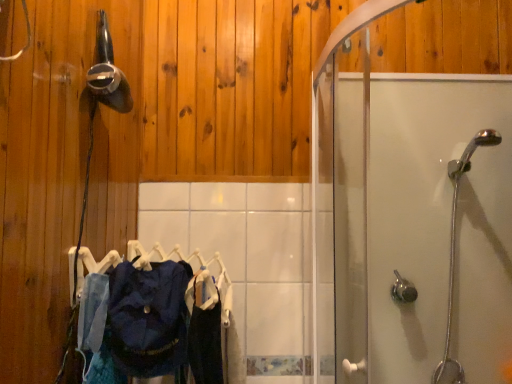
This screenshot has height=384, width=512. Describe the element at coordinates (148, 318) in the screenshot. I see `dark blue fabric at center, the first clothing in the left-to-right sequence` at that location.

Identify the location of dark blue fabric at center, acting as the 1th clothing starting from the right. The height and width of the screenshot is (384, 512). (205, 343).

Where is `transparent glass shower door at right`? transparent glass shower door at right is located at coordinates point(415,214).

Find the location of a particular element. This screenshot has height=384, width=512. the 2nd shower to the right of the metallic silver hairdryer at upper left, the 1th shower positioned from the left, starting your count from the anchor is located at coordinates (455, 252).

Is chrome metallic showerhead at right, which is counted as the first shower, starting from the right, bigger than metallic silver hairdryer at upper left, the third shower ordered from the bottom?

Correct, chrome metallic showerhead at right, which is counted as the first shower, starting from the right, is larger in size than metallic silver hairdryer at upper left, the third shower ordered from the bottom.

From a real-world perspective, is chrome metallic showerhead at right, which is counted as the first shower, starting from the right, located higher than metallic silver hairdryer at upper left, the third shower viewed from the right?

No, from a real-world perspective, chrome metallic showerhead at right, which is counted as the first shower, starting from the right, is not above metallic silver hairdryer at upper left, the third shower viewed from the right.

Does transparent glass shower door at right appear on the left side of dark blue fabric at center, the first clothing in the left-to-right sequence?

In fact, transparent glass shower door at right is to the right of dark blue fabric at center, the first clothing in the left-to-right sequence.

Considering the sizes of objects transparent glass shower door at right and dark blue fabric at center, which is counted as the second clothing, starting from the right, in the image provided, who is smaller, transparent glass shower door at right or dark blue fabric at center, which is counted as the second clothing, starting from the right,?

dark blue fabric at center, which is counted as the second clothing, starting from the right.

Considering the relative positions of transparent glass shower door at right and dark blue fabric at center, the first clothing in the left-to-right sequence, in the image provided, is transparent glass shower door at right in front of dark blue fabric at center, the first clothing in the left-to-right sequence,?

Yes, transparent glass shower door at right is closer to the camera.

Is transparent glass shower door at right facing towards dark blue fabric at center, the first clothing in the left-to-right sequence?

Yes, transparent glass shower door at right is facing dark blue fabric at center, the first clothing in the left-to-right sequence.

Is dark blue fabric at center, which is counted as the second clothing, starting from the right, positioned before dark blue fabric at center, the second clothing when ordered from left to right?

Yes, it is.

Considering the relative sizes of dark blue fabric at center, which is counted as the second clothing, starting from the right, and dark blue fabric at center, the second clothing when ordered from left to right, in the image provided, is dark blue fabric at center, which is counted as the second clothing, starting from the right, shorter than dark blue fabric at center, the second clothing when ordered from left to right,?

Yes.

Looking at this image, is dark blue fabric at center, the second clothing when ordered from left to right, at the back of dark blue fabric at center, which is counted as the second clothing, starting from the right?

No, dark blue fabric at center, which is counted as the second clothing, starting from the right, is not facing the opposite direction of dark blue fabric at center, the second clothing when ordered from left to right.

Considering the relative positions of transparent glass shower door at right and chrome metallic showerhead at right, which is counted as the second shower, starting from the bottom, in the image provided, is transparent glass shower door at right in front of chrome metallic showerhead at right, which is counted as the second shower, starting from the bottom,?

Yes, the depth of transparent glass shower door at right is less than that of chrome metallic showerhead at right, which is counted as the second shower, starting from the bottom.

From a real-world perspective, who is located higher, transparent glass shower door at right or chrome metallic showerhead at right, which is counted as the first shower, starting from the right?

transparent glass shower door at right.

In the scene shown: Which of these two, transparent glass shower door at right or chrome metallic showerhead at right, placed as the 2th shower when sorted from top to bottom, is thinner?

chrome metallic showerhead at right, placed as the 2th shower when sorted from top to bottom, is thinner.

From the image's perspective, between transparent glass shower door at right and chrome metallic showerhead at right, placed as the 2th shower when sorted from top to bottom, which one is located above?

transparent glass shower door at right, from the image's perspective.

Is dark blue fabric at center, which is counted as the second clothing, starting from the right, smaller than blue fabric clothes at center?

Indeed, dark blue fabric at center, which is counted as the second clothing, starting from the right, has a smaller size compared to blue fabric clothes at center.

Where is `laundry behind the dark blue fabric at center, which is counted as the second clothing, starting from the right`? The image size is (512, 384). laundry behind the dark blue fabric at center, which is counted as the second clothing, starting from the right is located at coordinates (213, 308).

Could blue fabric clothes at center be considered to be inside dark blue fabric at center, which is counted as the second clothing, starting from the right?

No, dark blue fabric at center, which is counted as the second clothing, starting from the right, does not contain blue fabric clothes at center.

Considering the positions of objects metallic silver hairdryer at upper left, the third shower ordered from the bottom, and transparent glass shower door at right in the image provided, who is in front, metallic silver hairdryer at upper left, the third shower ordered from the bottom, or transparent glass shower door at right?

transparent glass shower door at right is in front.

From the picture: Considering the relative sizes of metallic silver hairdryer at upper left, the 1th shower positioned from the left, and transparent glass shower door at right in the image provided, is metallic silver hairdryer at upper left, the 1th shower positioned from the left, bigger than transparent glass shower door at right?

Actually, metallic silver hairdryer at upper left, the 1th shower positioned from the left, might be smaller than transparent glass shower door at right.

Considering the sizes of objects metallic silver hairdryer at upper left, the third shower ordered from the bottom, and transparent glass shower door at right in the image provided, who is wider, metallic silver hairdryer at upper left, the third shower ordered from the bottom, or transparent glass shower door at right?

With larger width is transparent glass shower door at right.

Measure the distance between metallic silver hairdryer at upper left, which is counted as the 1th shower, starting from the top, and transparent glass shower door at right.

The distance of metallic silver hairdryer at upper left, which is counted as the 1th shower, starting from the top, from transparent glass shower door at right is 34.05 inches.

Who is taller, chrome metallic showerhead at right, which is counted as the first shower, starting from the right, or blue fabric clothes at center?

Standing taller between the two is chrome metallic showerhead at right, which is counted as the first shower, starting from the right.

Is chrome metallic showerhead at right, which ranks as the 3th shower in left-to-right order, bigger than blue fabric clothes at center?

No, chrome metallic showerhead at right, which ranks as the 3th shower in left-to-right order, is not bigger than blue fabric clothes at center.

Considering their positions, is chrome metallic showerhead at right, which is counted as the first shower, starting from the right, located in front of or behind blue fabric clothes at center?

Clearly, chrome metallic showerhead at right, which is counted as the first shower, starting from the right, is behind blue fabric clothes at center.

The width and height of the screenshot is (512, 384). Identify the location of shower above the chrome metallic showerhead at right, which ranks as the 3th shower in left-to-right order (from a real-world perspective). (108, 73).

The image size is (512, 384). Find the location of `clothing that is the 2nd object to the left of the transparent glass shower door at right, starting at the anchor`. clothing that is the 2nd object to the left of the transparent glass shower door at right, starting at the anchor is located at coordinates (148, 318).

Which object lies further to the anchor point chrome metallic showerhead at right, which ranks as the 3th shower in left-to-right order, metallic silver hairdryer at upper left, the third shower viewed from the right, or transparent glass shower door at right?

metallic silver hairdryer at upper left, the third shower viewed from the right, is further to chrome metallic showerhead at right, which ranks as the 3th shower in left-to-right order.

When comparing their distances from blue fabric clothes at center, does dark blue fabric at center, acting as the 1th clothing starting from the right, or satin nickel shower handle at lower right, which is the 2th shower from right to left, seem closer?

dark blue fabric at center, acting as the 1th clothing starting from the right.

Considering their positions, is chrome metallic showerhead at right, which is counted as the second shower, starting from the bottom, positioned further to dark blue fabric at center, the second clothing when ordered from left to right, than blue fabric clothes at center?

Based on the image, chrome metallic showerhead at right, which is counted as the second shower, starting from the bottom, appears to be further to dark blue fabric at center, the second clothing when ordered from left to right.

Estimate the real-world distances between objects in this image. Which object is further from dark blue fabric at center, which is counted as the second clothing, starting from the right, blue fabric clothes at center or satin nickel shower handle at lower right, the third shower positioned from the top?

Based on the image, satin nickel shower handle at lower right, the third shower positioned from the top, appears to be further to dark blue fabric at center, which is counted as the second clothing, starting from the right.

From the image, which object appears to be nearer to metallic silver hairdryer at upper left, the 1th shower positioned from the left, satin nickel shower handle at lower right, which is the 2th shower from right to left, or chrome metallic showerhead at right, which is counted as the second shower, starting from the bottom?

satin nickel shower handle at lower right, which is the 2th shower from right to left, is closer to metallic silver hairdryer at upper left, the 1th shower positioned from the left.

From the image, which object appears to be farther from metallic silver hairdryer at upper left, the third shower viewed from the right, chrome metallic showerhead at right, which is counted as the first shower, starting from the right, or transparent glass shower door at right?

chrome metallic showerhead at right, which is counted as the first shower, starting from the right, is further to metallic silver hairdryer at upper left, the third shower viewed from the right.

Based on their spatial positions, is metallic silver hairdryer at upper left, the third shower ordered from the bottom, or blue fabric clothes at center further from transparent glass shower door at right?

Among the two, metallic silver hairdryer at upper left, the third shower ordered from the bottom, is located further to transparent glass shower door at right.

When comparing their distances from dark blue fabric at center, which is counted as the second clothing, starting from the right, does chrome metallic showerhead at right, which ranks as the 3th shower in left-to-right order, or satin nickel shower handle at lower right, which is the 2th shower from right to left, seem further?

chrome metallic showerhead at right, which ranks as the 3th shower in left-to-right order, lies further to dark blue fabric at center, which is counted as the second clothing, starting from the right, than the other object.

The image size is (512, 384). I want to click on screen door between dark blue fabric at center, which is counted as the second clothing, starting from the right, and chrome metallic showerhead at right, which is counted as the second shower, starting from the bottom, so tap(415, 214).

Where is `shower located between dark blue fabric at center, the first clothing in the left-to-right sequence, and chrome metallic showerhead at right, which ranks as the 3th shower in left-to-right order, in the left-right direction`? The width and height of the screenshot is (512, 384). shower located between dark blue fabric at center, the first clothing in the left-to-right sequence, and chrome metallic showerhead at right, which ranks as the 3th shower in left-to-right order, in the left-right direction is located at coordinates (403, 290).

At what (x,y) coordinates should I click in order to perform the action: click on laundry between metallic silver hairdryer at upper left, which is counted as the 1th shower, starting from the top, and transparent glass shower door at right. Please return your answer as a coordinate pair (x, y). This screenshot has height=384, width=512. Looking at the image, I should click on (213, 308).

Where is `clothing situated between dark blue fabric at center, which is counted as the second clothing, starting from the right, and chrome metallic showerhead at right, which is counted as the first shower, starting from the right, from left to right`? Image resolution: width=512 pixels, height=384 pixels. clothing situated between dark blue fabric at center, which is counted as the second clothing, starting from the right, and chrome metallic showerhead at right, which is counted as the first shower, starting from the right, from left to right is located at coordinates (205, 343).